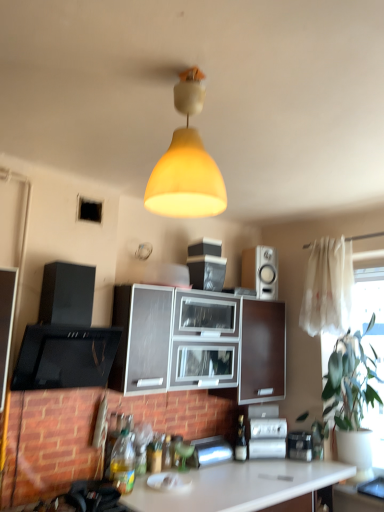
Where is `empty space that is ontop of yellow matte lampshade at center (from a real-world perspective)`? The width and height of the screenshot is (384, 512). empty space that is ontop of yellow matte lampshade at center (from a real-world perspective) is located at coordinates (189, 69).